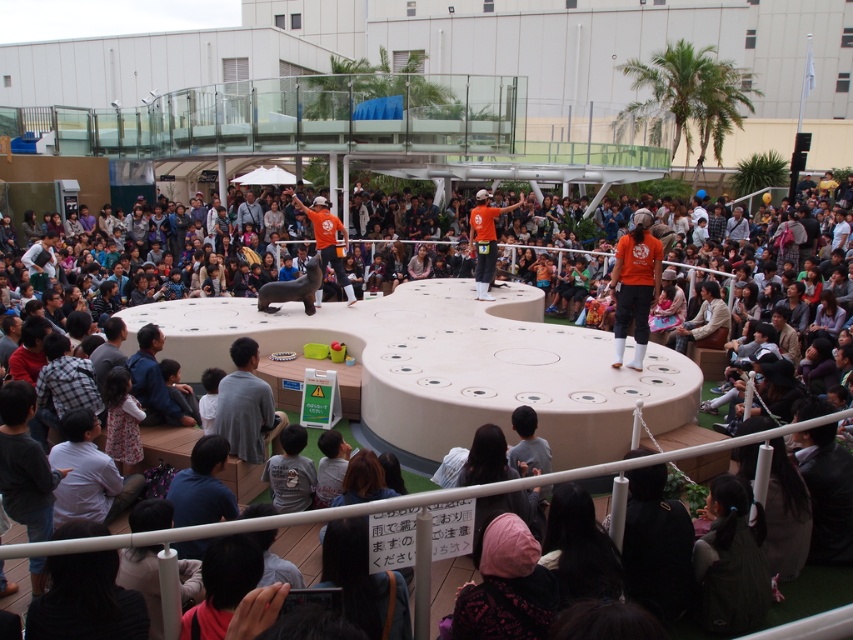
Is point (163, 400) closer to camera compared to point (300, 204)?

Yes, it is.

Which is behind, point (165, 390) or point (320, 220)?

The point (320, 220) is more distant.

Between point (144, 384) and point (326, 216), which one is positioned behind?

The point (326, 216) is behind.

The image size is (853, 640). Find the location of `blue fabric jacket at lower left`. blue fabric jacket at lower left is located at coordinates tap(154, 381).

Does orange fabric shirt at center appear on the right side of orange fabric man at center?

Yes, orange fabric shirt at center is to the right of orange fabric man at center.

Is orange fabric shirt at center thinner than orange fabric man at center?

Yes, orange fabric shirt at center is thinner than orange fabric man at center.

Where is `orange fabric shirt at center`? This screenshot has height=640, width=853. orange fabric shirt at center is located at coordinates (485, 240).

Who is positioned more to the right, blue fabric jacket at lower left or orange fabric shirt at center?

From the viewer's perspective, orange fabric shirt at center appears more on the right side.

Looking at this image, is blue fabric jacket at lower left below orange fabric shirt at center?

Correct, blue fabric jacket at lower left is located below orange fabric shirt at center.

Who is more distant from viewer, (148, 417) or (473, 211)?

The point (473, 211) is behind.

Where is `blue fabric jacket at lower left`? This screenshot has height=640, width=853. blue fabric jacket at lower left is located at coordinates (154, 381).